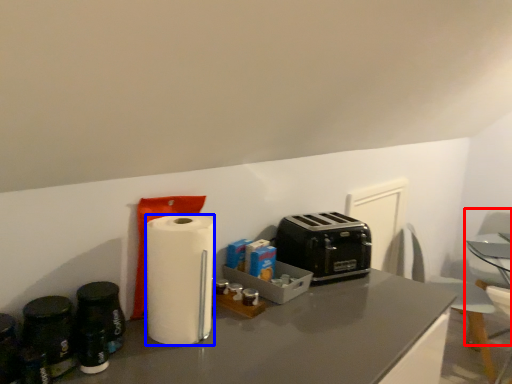
Question: Which object is further to the camera taking this photo, swivel chair (highlighted by a red box) or paper towel (highlighted by a blue box)?

Choices:
 (A) swivel chair
 (B) paper towel

Answer: (A)